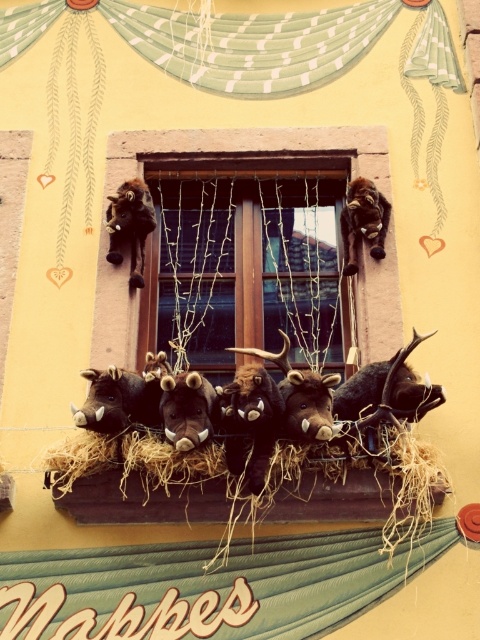
You are a customer looking at the window display of a store. You see a brown plush goat at upper left and a brown plush toy at upper center. Which one do you think is bigger?

The brown plush goat at upper left is larger in size than the brown plush toy at upper center.

From the picture: You are an interior designer planning to add a new decorative item to the window display. The wooden window at center currently has the brown plush goat at upper left above it. Where should you place the new item to maintain symmetry with the existing arrangement?

To maintain symmetry, the new item should be placed below the brown plush goat at upper left, mirroring the position of the wooden window at center.